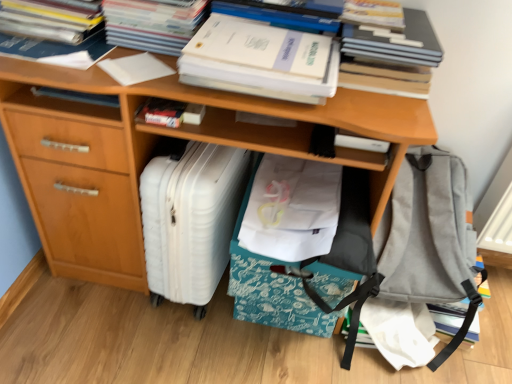
Question: Is hardcover book at upper center, which is the 5th book in left-to-right order, smaller than white matte paper at upper center, the 3th paperback book viewed from the left?

Choices:
 (A) yes
 (B) no

Answer: (A)

Question: From a real-world perspective, is hardcover book at upper center, which is the 5th book in left-to-right order, over white matte paper at upper center, the 3th paperback book viewed from the left?

Choices:
 (A) yes
 (B) no

Answer: (A)

Question: Is hardcover book at upper center, which is the 5th book in left-to-right order, behind white matte paper at upper center, which appears as the first paperback book when viewed from the right?

Choices:
 (A) no
 (B) yes

Answer: (B)

Question: From a real-world perspective, is hardcover book at upper center, which is the 5th book in left-to-right order, located beneath white matte paper at upper center, the 3th paperback book viewed from the left?

Choices:
 (A) yes
 (B) no

Answer: (B)

Question: Can you confirm if hardcover book at upper center, the 2th book from the right, is positioned to the left of white matte paper at upper center, the 3th paperback book viewed from the left?

Choices:
 (A) no
 (B) yes

Answer: (A)

Question: Considering the relative sizes of hardcover book at upper center, which is the 5th book in left-to-right order, and white matte paper at upper center, which appears as the first paperback book when viewed from the right, in the image provided, is hardcover book at upper center, which is the 5th book in left-to-right order, wider than white matte paper at upper center, which appears as the first paperback book when viewed from the right,?

Choices:
 (A) no
 (B) yes

Answer: (A)

Question: Is white paper at upper center, positioned as the 2th paperback book in right-to-left order, smaller than white matte book at center, positioned as the 4th book in left-to-right order?

Choices:
 (A) no
 (B) yes

Answer: (A)

Question: Can you confirm if white paper at upper center, the second paperback book viewed from the left, is wider than white matte book at center, the 3th book viewed from the right?

Choices:
 (A) no
 (B) yes

Answer: (B)

Question: From a real-world perspective, is white paper at upper center, positioned as the 2th paperback book in right-to-left order, positioned over white matte book at center, positioned as the 4th book in left-to-right order, based on gravity?

Choices:
 (A) yes
 (B) no

Answer: (A)

Question: From the image's perspective, is white paper at upper center, the second paperback book viewed from the left, under white matte book at center, the 3th book viewed from the right?

Choices:
 (A) no
 (B) yes

Answer: (A)

Question: Can you see white paper at upper center, positioned as the 2th paperback book in right-to-left order, touching white matte book at center, positioned as the 4th book in left-to-right order?

Choices:
 (A) no
 (B) yes

Answer: (A)

Question: Is white paper at upper center, positioned as the 2th paperback book in right-to-left order, behind white matte book at center, the 3th book viewed from the right?

Choices:
 (A) yes
 (B) no

Answer: (B)

Question: From the image's perspective, is white paper at upper left, which is counted as the second book, starting from the left, under white plastic suitcase at lower left?

Choices:
 (A) yes
 (B) no

Answer: (B)